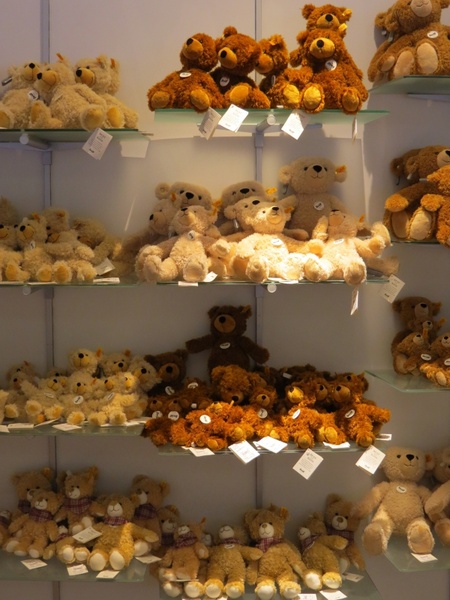
This screenshot has width=450, height=600. I want to click on shelf, so click(x=405, y=386).